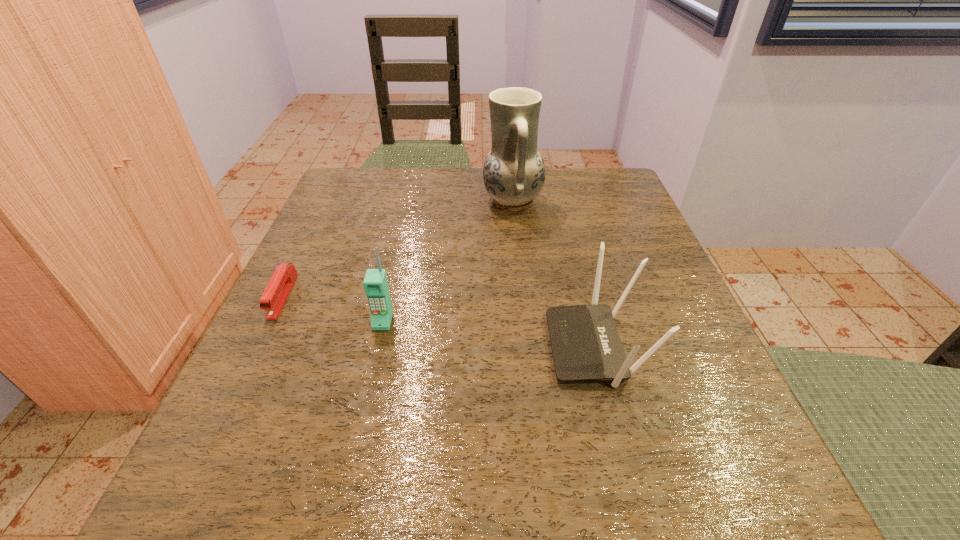
I want to click on pottery, so click(x=514, y=172).

This screenshot has height=540, width=960. Find the location of `the tallest object`. the tallest object is located at coordinates (514, 172).

This screenshot has width=960, height=540. I want to click on cellular telephone, so click(375, 283).

Find the location of a particular element. Image resolution: width=960 pixels, height=540 pixels. router is located at coordinates (585, 343).

You are a GUI agent. You are given a task and a screenshot of the screen. Output one action in this format:
    pyautogui.click(x=<x>, y=<y>)
    Task: Click on the stapler
    Image resolution: width=960 pixels, height=540 pixels.
    Given the screenshot: What is the action you would take?
    pyautogui.click(x=277, y=291)

The height and width of the screenshot is (540, 960). Identify the location of the shortest object. (277, 291).

This screenshot has height=540, width=960. Identify the location of free region located on the front of the farthest object. (527, 335).

Image resolution: width=960 pixels, height=540 pixels. I want to click on vacant area situated on the keypad of the third object from right to left, so click(x=372, y=365).

Find the location of a particular element. This screenshot has width=960, height=540. free spot located 0.250m on the front-facing side of the router is located at coordinates (393, 347).

Locate an element on the screen. blank space located 0.190m on the front-facing side of the router is located at coordinates (430, 347).